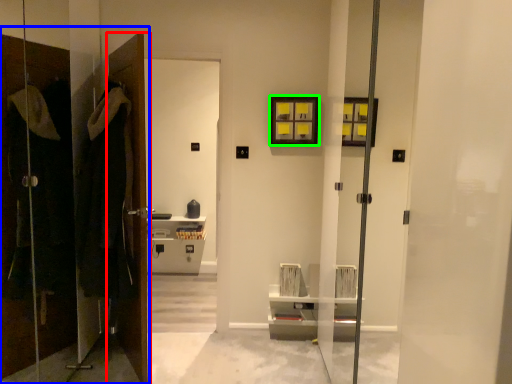
Question: Which object is positioned closest to door (highlighted by a red box)? Select from closet (highlighted by a blue box) and picture frame (highlighted by a green box).

Choices:
 (A) closet
 (B) picture frame

Answer: (A)